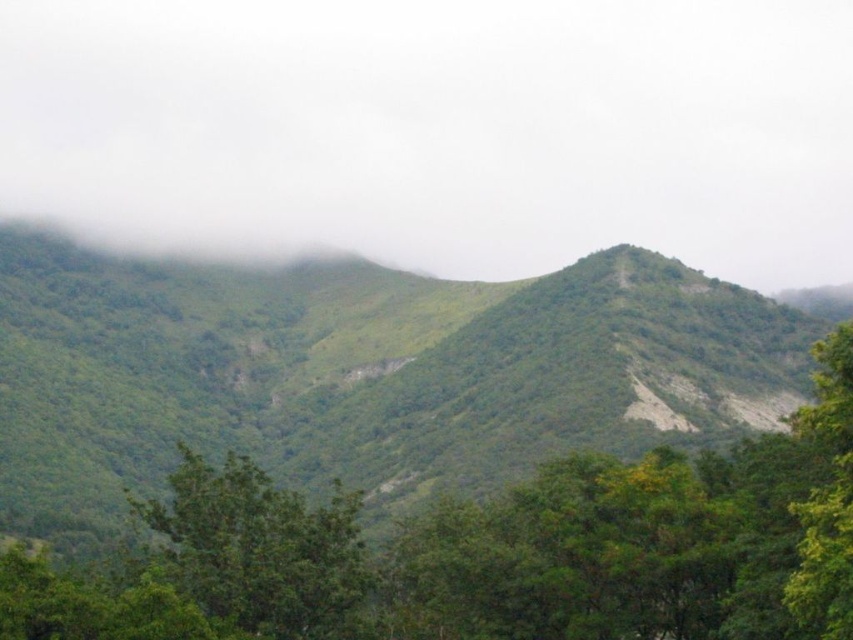
Question: Among these objects, which one is farthest from the camera?

Choices:
 (A) green leafy tree at center
 (B) white fluffy cloud at upper center

Answer: (B)

Question: Which of the following is the closest to the observer?

Choices:
 (A) green leafy tree at center
 (B) green leafy hill at center

Answer: (A)

Question: Can you confirm if white fluffy cloud at upper center is positioned to the right of green leafy hill at center?

Choices:
 (A) no
 (B) yes

Answer: (B)

Question: Does white fluffy cloud at upper center appear over green leafy tree at center?

Choices:
 (A) yes
 (B) no

Answer: (A)

Question: Is green leafy hill at center thinner than green leafy tree at center?

Choices:
 (A) yes
 (B) no

Answer: (B)

Question: Which is nearer to the white fluffy cloud at upper center?

Choices:
 (A) green leafy tree at center
 (B) green leafy hill at center

Answer: (B)